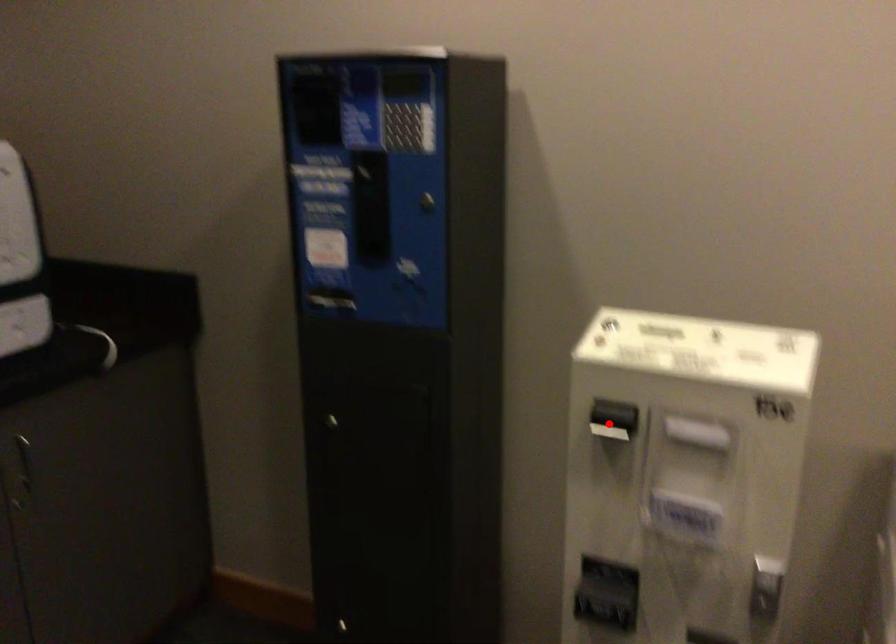
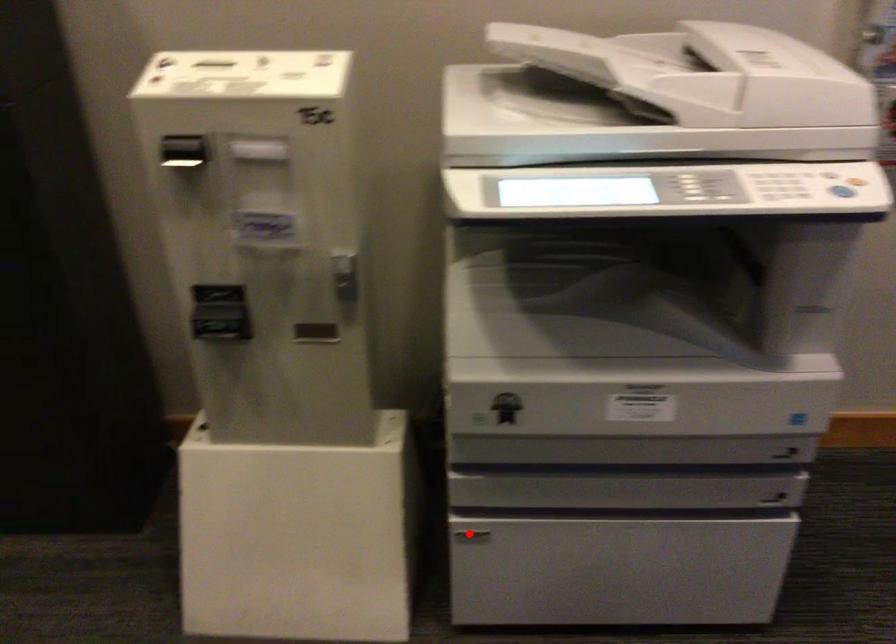
I am providing you with two images of the same scene from different viewpoints. A red point is marked on the first image and another point is marked on the second image. Is the red point in image1 aligned with the point shown in image2?

No